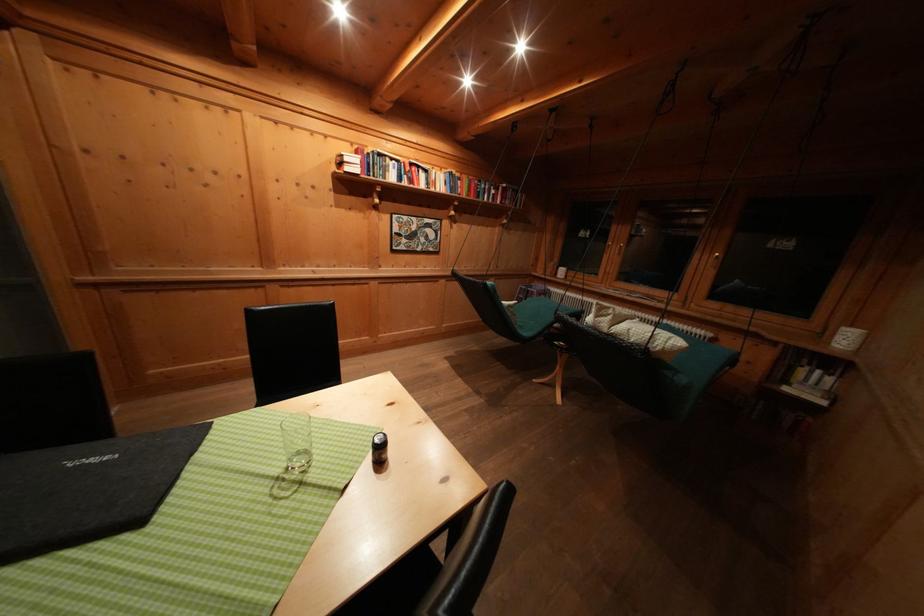
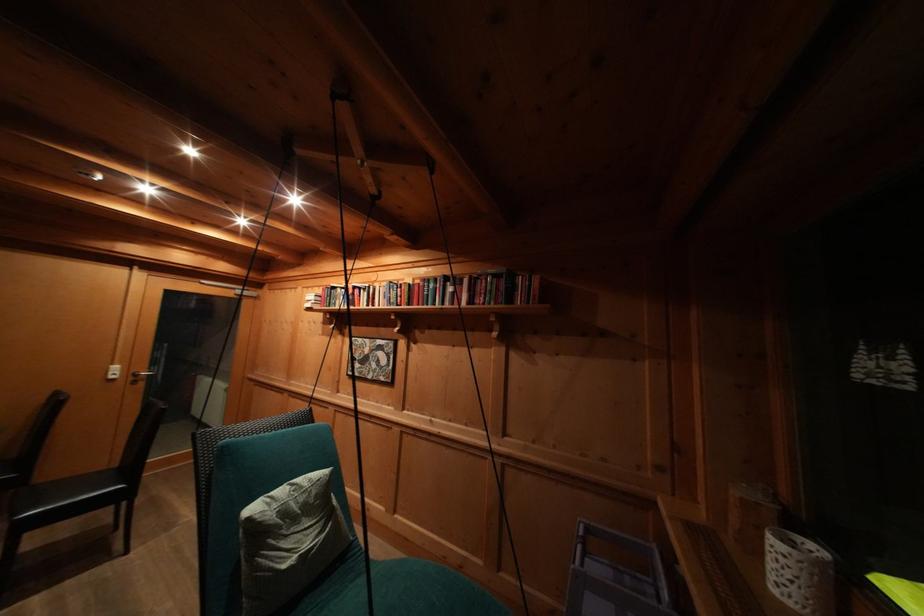
The point at (283, 128) is marked in the first image. Where is the corresponding point in the second image?

(313, 293)